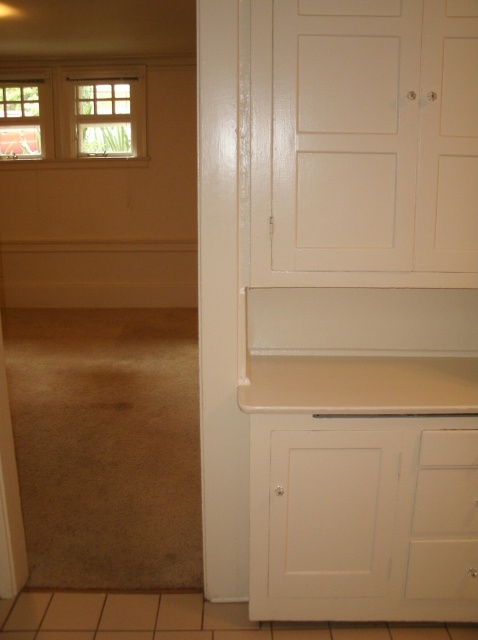
Question: Which object appears farthest from the camera in this image?

Choices:
 (A) wooden window at upper left
 (B) matte glass window at upper left
 (C) clear glass window at upper left

Answer: (C)

Question: Which point is closer to the camera?

Choices:
 (A) matte glass window at upper left
 (B) wooden window at upper left

Answer: (B)

Question: Can you confirm if matte glass window at upper left is bigger than clear glass window at upper left?

Choices:
 (A) yes
 (B) no

Answer: (A)

Question: Is the position of matte glass window at upper left more distant than that of wooden window at upper left?

Choices:
 (A) no
 (B) yes

Answer: (B)

Question: Which point is closer to the camera?

Choices:
 (A) (98, 108)
 (B) (26, 92)
 (C) (30, 97)

Answer: (B)

Question: Can you confirm if matte glass window at upper left is bigger than wooden window at upper left?

Choices:
 (A) yes
 (B) no

Answer: (A)